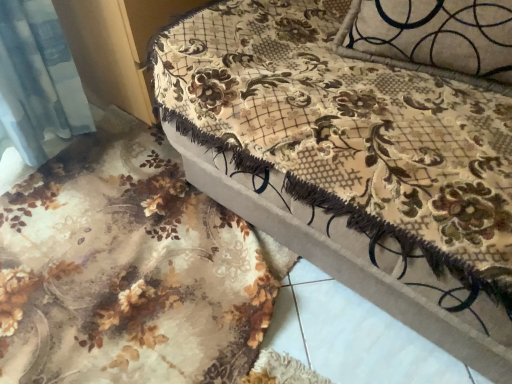
Question: Is point (274, 64) positioned closer to the camera than point (69, 306)?

Choices:
 (A) closer
 (B) farther

Answer: (A)

Question: Based on their positions, is velvet floral-patterned ottoman at center located to the left or right of velvet floral bed frame at upper right?

Choices:
 (A) right
 (B) left

Answer: (A)

Question: From the image's perspective, is velvet floral-patterned ottoman at center positioned above or below velvet floral bed frame at upper right?

Choices:
 (A) above
 (B) below

Answer: (A)

Question: Is point (181, 283) positioned closer to the camera than point (386, 23)?

Choices:
 (A) closer
 (B) farther

Answer: (B)

Question: Which is correct: velvet floral bed frame at upper right is inside velvet floral-patterned ottoman at center, or outside of it?

Choices:
 (A) outside
 (B) inside

Answer: (A)

Question: Would you say velvet floral bed frame at upper right is to the left or to the right of velvet floral-patterned ottoman at center in the picture?

Choices:
 (A) left
 (B) right

Answer: (A)

Question: From the image's perspective, is velvet floral bed frame at upper right positioned above or below velvet floral-patterned ottoman at center?

Choices:
 (A) below
 (B) above

Answer: (A)